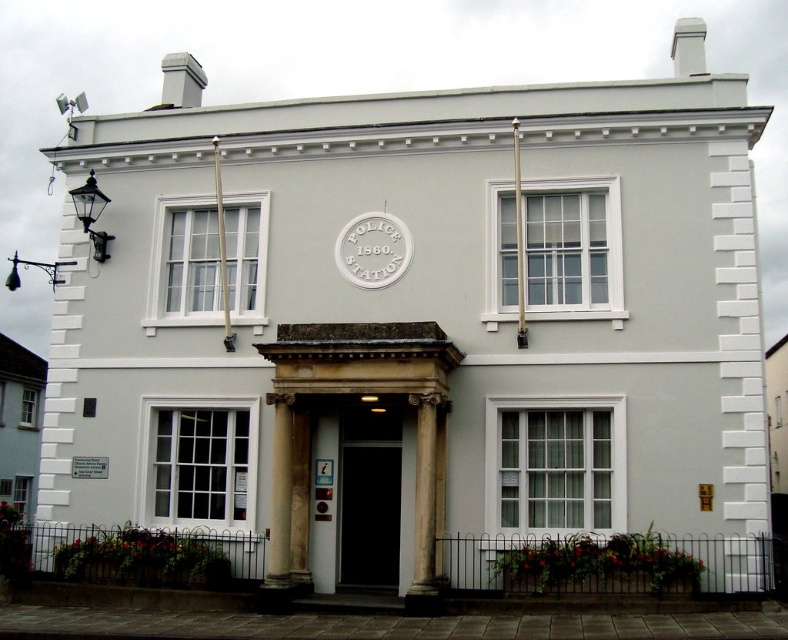
Between white stone clock at center and white marble pillar at center, which one is positioned lower?

white marble pillar at center

Is point (352, 260) positioned behind point (277, 547)?

Yes, it is.

You are a GUI agent. You are given a task and a screenshot of the screen. Output one action in this format:
    pyautogui.click(x=<x>, y=<y>)
    Task: Click on the white stone clock at center
    This screenshot has height=640, width=788.
    Given the screenshot: What is the action you would take?
    pyautogui.click(x=374, y=250)

Consider the image. Is black glass door at center above white stone clock at center?

Actually, black glass door at center is below white stone clock at center.

Where is `black glass door at center`? black glass door at center is located at coordinates (370, 496).

Does point (385, 444) come in front of point (348, 248)?

Yes, it is in front of point (348, 248).

This screenshot has width=788, height=640. Identify the location of black glass door at center. (370, 496).

Is black glass door at center bigger than white marble column at center?

Incorrect, black glass door at center is not larger than white marble column at center.

Is black glass door at center further to the viewer compared to white marble column at center?

Yes, it is.

Is point (346, 532) positioned before point (422, 436)?

No, (346, 532) is further to viewer.

In order to click on black glass door at center in this screenshot , I will do `click(370, 496)`.